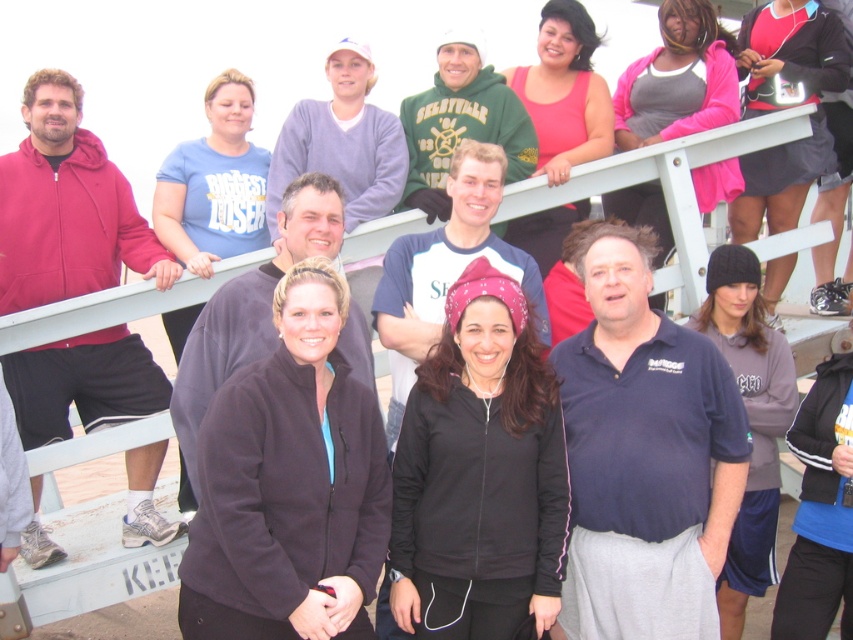
Question: Which point appears closest to the camera in this image?

Choices:
 (A) (386, 308)
 (B) (50, 284)
 (C) (631, 394)

Answer: (C)

Question: Can you confirm if matte red hoodie at left is bigger than pink bandana at center?

Choices:
 (A) yes
 (B) no

Answer: (B)

Question: Which point is closer to the camera?

Choices:
 (A) (22, 172)
 (B) (601, 358)
 (C) (375, 324)
 (D) (196, 333)

Answer: (D)

Question: Which point is farther to the camera?

Choices:
 (A) (592, 332)
 (B) (305, 208)

Answer: (A)

Question: Is dark blue polo shirt at center positioned at the back of pink bandana at center?

Choices:
 (A) yes
 (B) no

Answer: (B)

Question: In this image, where is dark blue polo shirt at center located relative to matte red hoodie at left?

Choices:
 (A) above
 (B) below

Answer: (A)